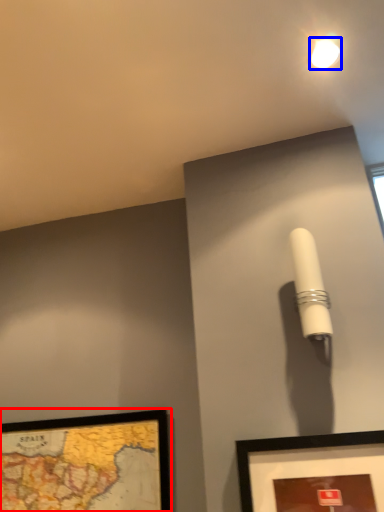
Question: Which object appears farthest to the camera in this image, picture frame (highlighted by a red box) or droplight (highlighted by a blue box)?

Choices:
 (A) picture frame
 (B) droplight

Answer: (A)